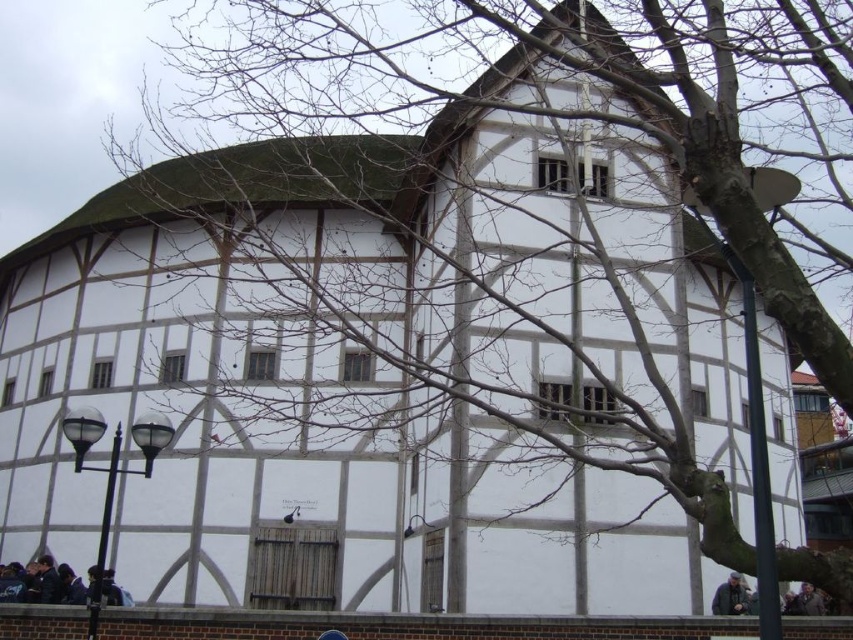
Question: Does dark blue jacket at lower left appear under gray wool coat at lower right?

Choices:
 (A) no
 (B) yes

Answer: (B)

Question: Which of the following is the farthest from the observer?

Choices:
 (A) click(740, 582)
 (B) click(798, 612)

Answer: (A)

Question: Is dark blue jacket at lower left wider than dark gray jacket at lower right?

Choices:
 (A) yes
 (B) no

Answer: (A)

Question: Which is farther from the dark blue jacket at lower left?

Choices:
 (A) dark gray jacket at lower right
 (B) gray wool coat at lower right

Answer: (B)

Question: Estimate the real-world distances between objects in this image. Which object is closer to the gray wool coat at lower right?

Choices:
 (A) dark blue jacket at lower left
 (B) dark gray jacket at lower right

Answer: (B)

Question: Is dark blue jacket at lower left wider than gray wool coat at lower right?

Choices:
 (A) yes
 (B) no

Answer: (A)